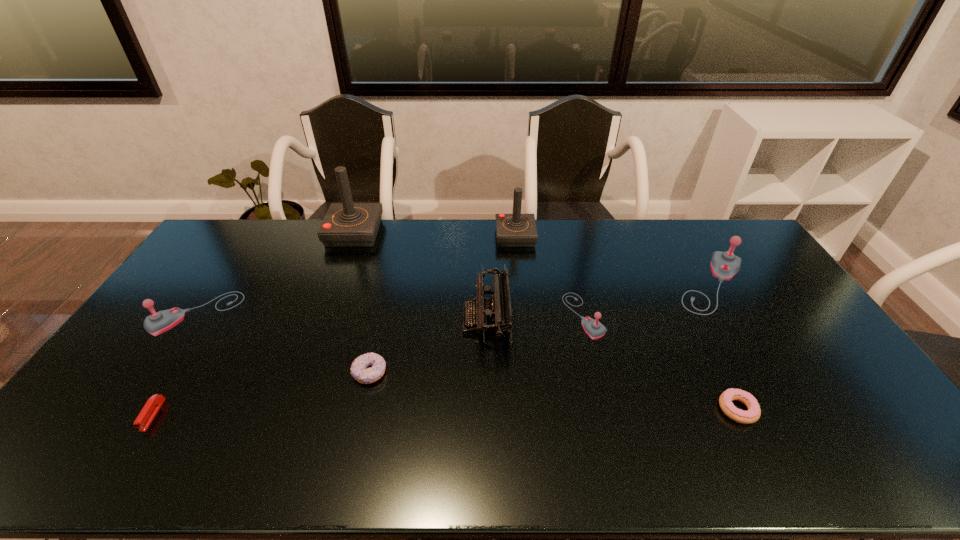
Where is `the shortest joystick`? the shortest joystick is located at coordinates 594,329.

This screenshot has height=540, width=960. Find the location of `the farther doughnut`. the farther doughnut is located at coordinates (359, 369).

Identify the location of the sixth object from right to left. (359, 369).

Locate an element on the screen. the right doughnut is located at coordinates (753, 413).

Find the location of `pink doughnut`. pink doughnut is located at coordinates (753, 413).

At what (x,y) coordinates should I click in order to perform the action: click on red stapler. Please return your answer as a coordinate pair (x, y). This screenshot has height=540, width=960. Looking at the image, I should click on pos(150,409).

Find the location of a particular element. The image size is (960, 540). free spot located on the rectangular base of the tallest joystick is located at coordinates (408, 233).

Image resolution: width=960 pixels, height=540 pixels. Identify the location of vacant space located on the rectangular base of the smaller red joystick. 517,257.

Find the location of a particular element. The height and width of the screenshot is (540, 960). free region located 0.080m on the right of the rightmost gray joystick is located at coordinates (776, 284).

Find the location of a particular element. vacant space located on the typing side of the typewriter is located at coordinates (344, 319).